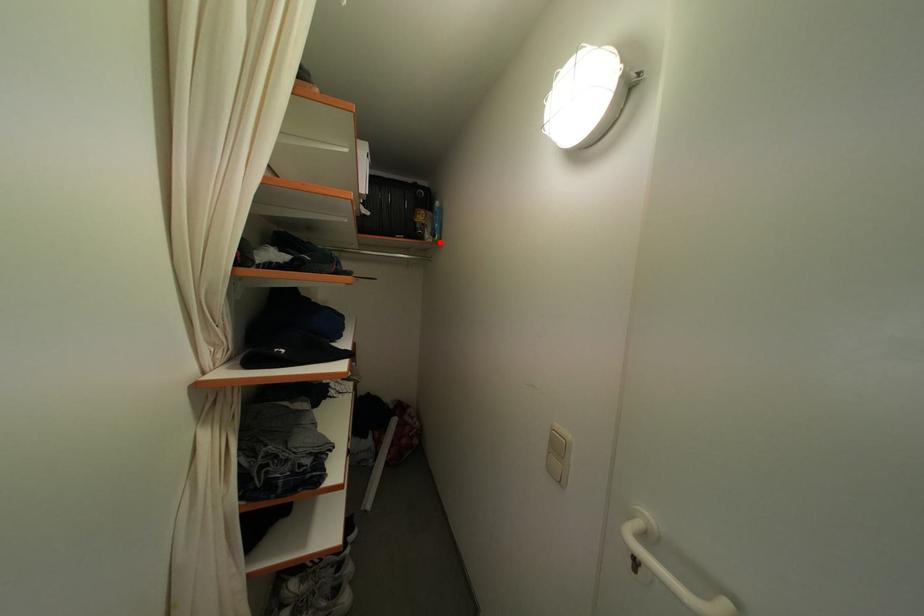
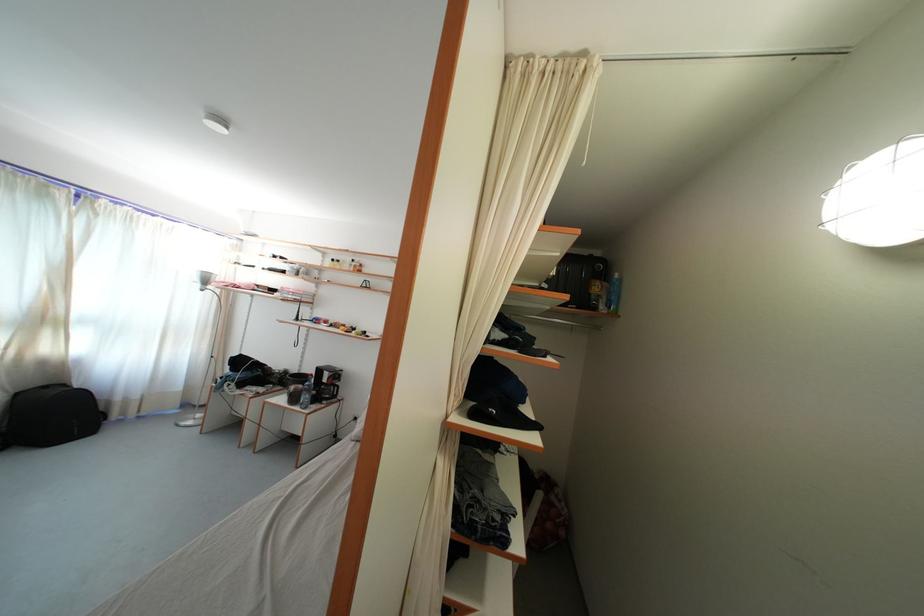
In the second image, find the point that corresponds to the highlighted location in the first image.

(615, 314)